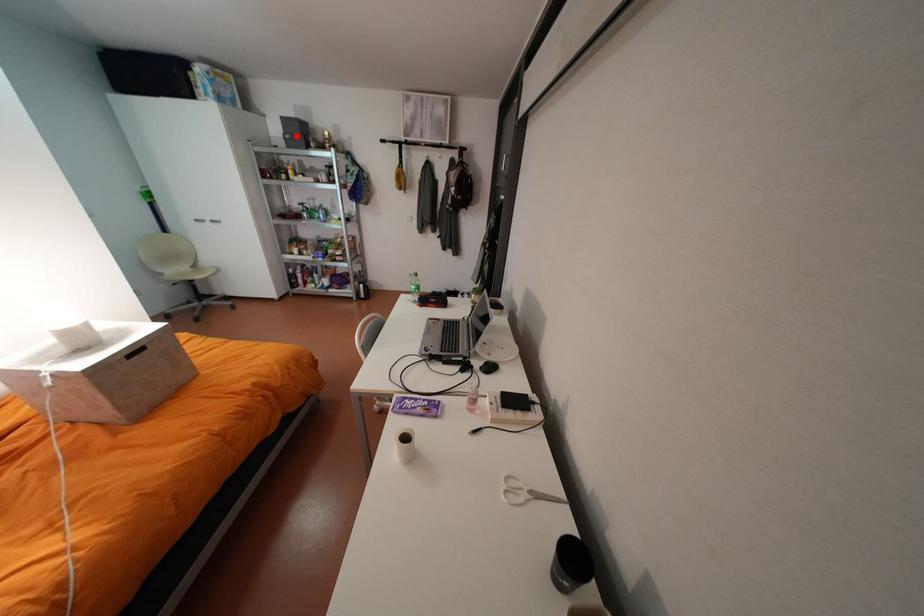
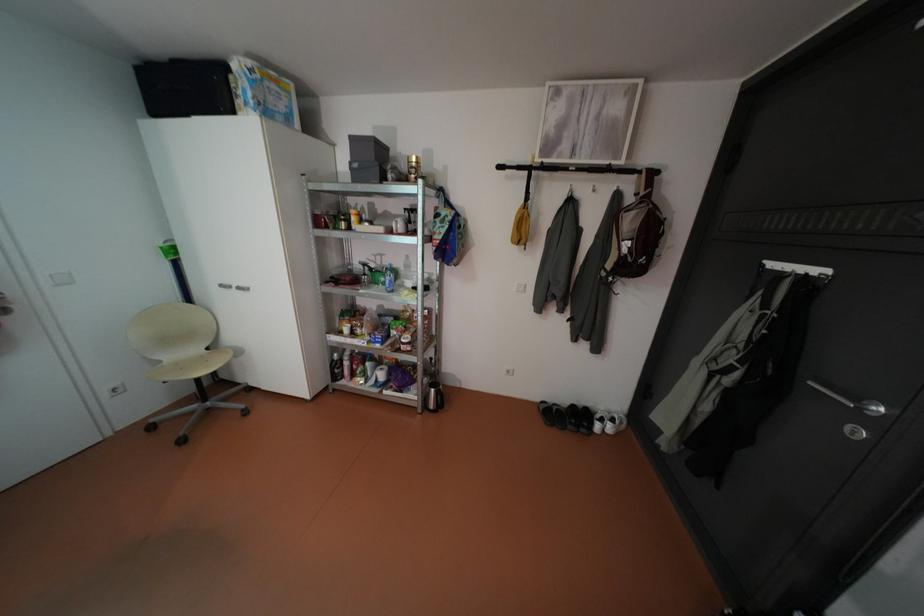
In the second image, find the point that corresponds to the highlighted location in the first image.

(365, 164)